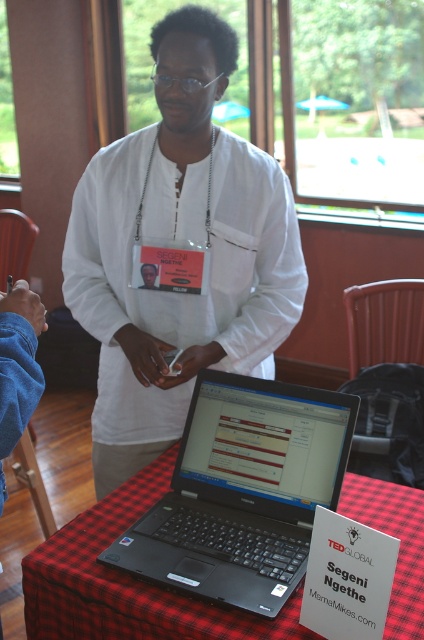
Does point (161, 451) come farther from viewer compared to point (219, 436)?

Yes, it is.

Does white matte shirt at center have a greater width compared to black plastic laptop at center?

Indeed, white matte shirt at center has a greater width compared to black plastic laptop at center.

The image size is (424, 640). Find the location of `white matte shirt at center`. white matte shirt at center is located at coordinates (178, 252).

Who is positioned more to the left, red plaid tablecloth at lower center or matte white id card at center?

matte white id card at center is more to the left.

Can you confirm if red plaid tablecloth at lower center is positioned above matte white id card at center?

No.

Identify the location of red plaid tablecloth at lower center. (128, 582).

You are a GUI agent. You are given a task and a screenshot of the screen. Output one action in this format:
    pyautogui.click(x=<x>, y=<y>)
    Task: Click on the red plaid tablecloth at lower center
    
    Given the screenshot: What is the action you would take?
    pyautogui.click(x=128, y=582)

Is white matte shirt at center taller than red plaid tablecloth at lower center?

Indeed, white matte shirt at center has a greater height compared to red plaid tablecloth at lower center.

Between white matte shirt at center and red plaid tablecloth at lower center, which one has less height?

red plaid tablecloth at lower center is shorter.

Where is `white matte shirt at center`? white matte shirt at center is located at coordinates (178, 252).